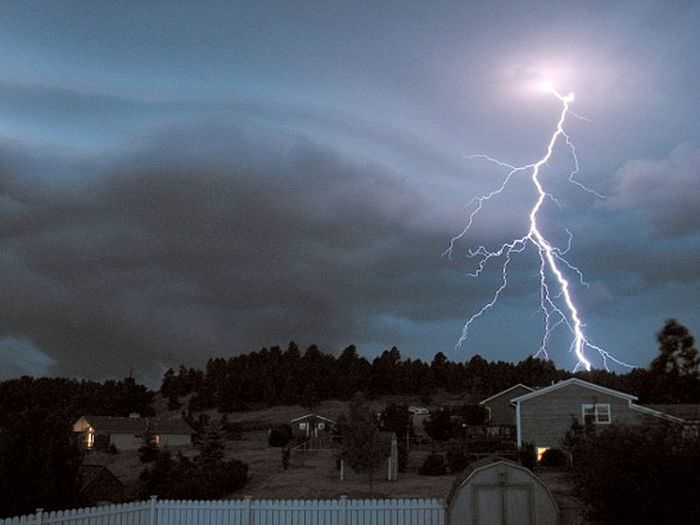
Find the location of a particular element. window is located at coordinates (603, 418).